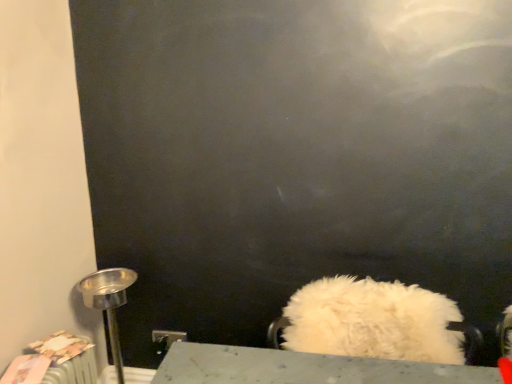
Question: In the image, is metallic silver table lamp at left positioned in front of or behind white fluffy cushion at lower center?

Choices:
 (A) front
 (B) behind

Answer: (B)

Question: Would you say metallic silver table lamp at left is inside or outside white fluffy cushion at lower center?

Choices:
 (A) outside
 (B) inside

Answer: (A)

Question: Considering the positions of metallic silver table lamp at left and white fluffy cushion at lower center in the image, is metallic silver table lamp at left bigger or smaller than white fluffy cushion at lower center?

Choices:
 (A) big
 (B) small

Answer: (B)

Question: Is point (357, 283) closer or farther from the camera than point (112, 354)?

Choices:
 (A) closer
 (B) farther

Answer: (A)

Question: Considering the positions of white fluffy cushion at lower center and metallic silver table lamp at left in the image, is white fluffy cushion at lower center taller or shorter than metallic silver table lamp at left?

Choices:
 (A) tall
 (B) short

Answer: (B)

Question: Relative to metallic silver table lamp at left, is white fluffy cushion at lower center in front or behind?

Choices:
 (A) front
 (B) behind

Answer: (A)

Question: From the image's perspective, relative to metallic silver table lamp at left, is white fluffy cushion at lower center above or below?

Choices:
 (A) below
 (B) above

Answer: (B)